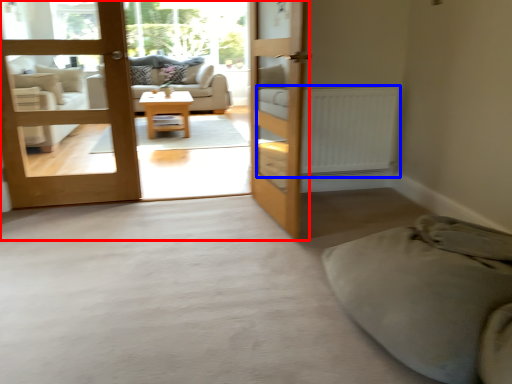
Question: Which point is further to the camera, bunk bed (highlighted by a red box) or radiator (highlighted by a blue box)?

Choices:
 (A) bunk bed
 (B) radiator

Answer: (B)